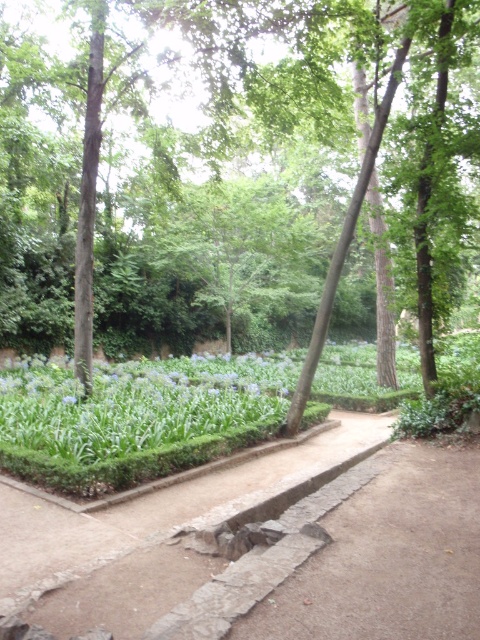
You are planning to take a photo of the brown wood tree at center and the blue matte flower at center in the garden. Which object should you focus on first if you want to capture both in a single frame without moving the camera?

You should focus on the brown wood tree at center first because it is taller than the blue matte flower at center, allowing you to frame it appropriately while ensuring the flower remains in the shot.

You are standing at the point marked as point (192, 268) in the garden scene. What object is located exactly at this point?

The brown wood tree at center is located exactly at point (192, 268).